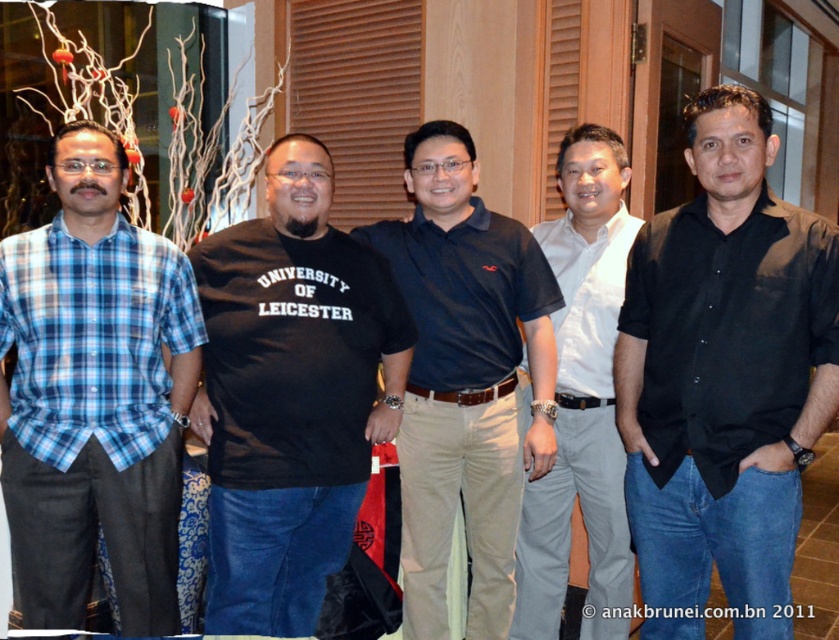
Question: Does black smooth shirt at right have a larger size compared to dark blue cotton polo shirt at center?

Choices:
 (A) yes
 (B) no

Answer: (A)

Question: Can you confirm if black smooth shirt at right is bigger than black cotton t-shirt at center?

Choices:
 (A) yes
 (B) no

Answer: (B)

Question: Which point is closer to the camera?

Choices:
 (A) (133, 241)
 (B) (280, 488)
 (C) (558, 403)
 (D) (655, 404)

Answer: (D)

Question: Which object appears closest to the camera in this image?

Choices:
 (A) white cotton shirt at center
 (B) black cotton t-shirt at center
 (C) dark blue cotton polo shirt at center
 (D) blue plaid shirt at left

Answer: (D)

Question: Is black smooth shirt at right positioned at the back of dark blue cotton polo shirt at center?

Choices:
 (A) no
 (B) yes

Answer: (A)

Question: Which of the following is the closest to the observer?

Choices:
 (A) black smooth shirt at right
 (B) black cotton t-shirt at center

Answer: (A)